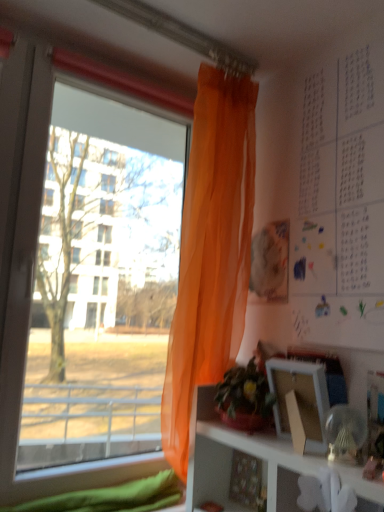
Question: Is translucent orange curtain at left placed right next to white matte picture frame at lower right?

Choices:
 (A) yes
 (B) no

Answer: (B)

Question: Is translucent orange curtain at left not close to white matte picture frame at lower right?

Choices:
 (A) yes
 (B) no

Answer: (B)

Question: Is the depth of translucent orange curtain at left greater than that of white matte picture frame at lower right?

Choices:
 (A) no
 (B) yes

Answer: (B)

Question: From a real-world perspective, is translucent orange curtain at left located higher than white matte picture frame at lower right?

Choices:
 (A) no
 (B) yes

Answer: (B)

Question: Is translucent orange curtain at left turned away from white matte picture frame at lower right?

Choices:
 (A) yes
 (B) no

Answer: (A)

Question: In the image, is transparent orange curtain at left positioned in front of or behind white matte picture frame at lower right?

Choices:
 (A) behind
 (B) front

Answer: (A)

Question: Is transparent orange curtain at left inside the boundaries of white matte picture frame at lower right, or outside?

Choices:
 (A) inside
 (B) outside

Answer: (B)

Question: From a real-world perspective, is transparent orange curtain at left positioned above or below white matte picture frame at lower right?

Choices:
 (A) below
 (B) above

Answer: (B)

Question: In terms of height, does transparent orange curtain at left look taller or shorter compared to white matte picture frame at lower right?

Choices:
 (A) tall
 (B) short

Answer: (A)

Question: Would you say white paper at upper right is inside or outside white matte picture frame at lower right?

Choices:
 (A) outside
 (B) inside

Answer: (A)

Question: From the image's perspective, is white paper at upper right located above or below white matte picture frame at lower right?

Choices:
 (A) below
 (B) above

Answer: (B)

Question: Considering the positions of white paper at upper right and white matte picture frame at lower right in the image, is white paper at upper right taller or shorter than white matte picture frame at lower right?

Choices:
 (A) tall
 (B) short

Answer: (A)

Question: Does point (365, 158) appear closer or farther from the camera than point (306, 407)?

Choices:
 (A) farther
 (B) closer

Answer: (A)

Question: Would you say translucent orange curtain at left is to the left or to the right of white paper at upper right in the picture?

Choices:
 (A) left
 (B) right

Answer: (A)

Question: In terms of width, does translucent orange curtain at left look wider or thinner when compared to white paper at upper right?

Choices:
 (A) thin
 (B) wide

Answer: (B)